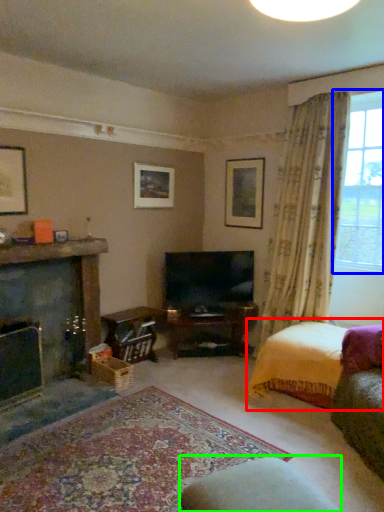
Question: Estimate the real-world distances between objects in this image. Which object is farther from bed (highlighted by a red box), window (highlighted by a blue box) or rocking chair (highlighted by a green box)?

Choices:
 (A) window
 (B) rocking chair

Answer: (B)